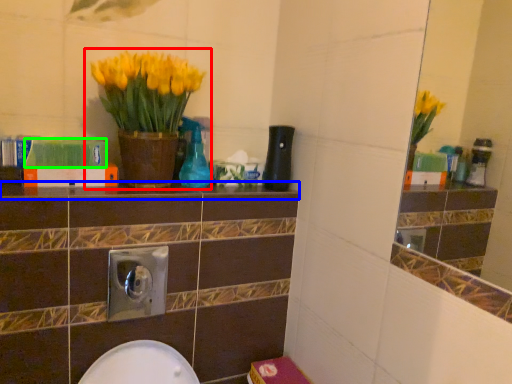
Question: Which is farther away from houseplant (highlighted by a red box)? ledge (highlighted by a blue box) or book (highlighted by a green box)?

Choices:
 (A) ledge
 (B) book

Answer: (A)